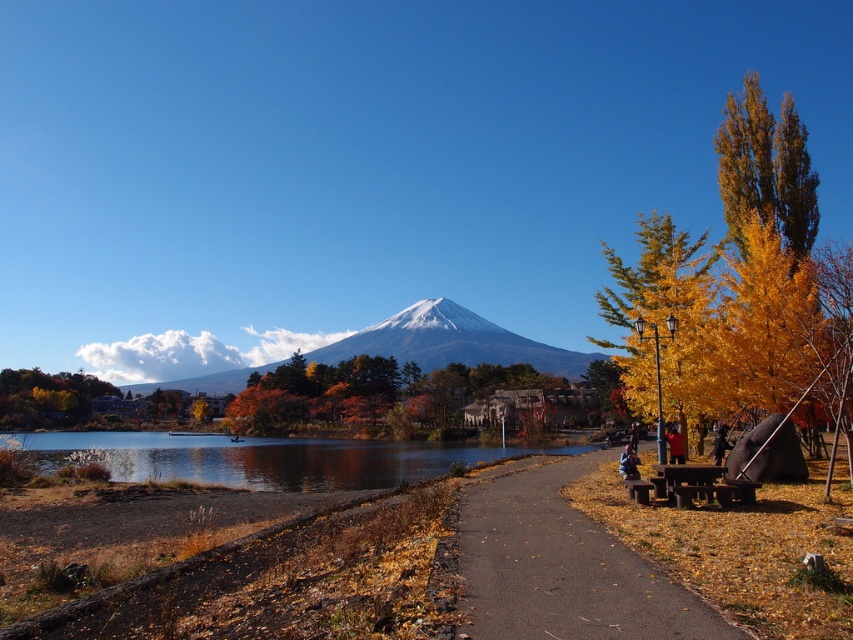
Looking at this image, which is more to the left, clear water at lower left or yellow fabric jacket at right?

From the viewer's perspective, clear water at lower left appears more on the left side.

Identify the location of clear water at lower left. The width and height of the screenshot is (853, 640). (262, 458).

Locate an element on the screen. The image size is (853, 640). clear water at lower left is located at coordinates (262, 458).

Is clear water at lower left positioned before white snow-covered mountain at center?

Yes, clear water at lower left is closer to the viewer.

Is point (250, 468) positioned before point (466, 362)?

That is True.

This screenshot has height=640, width=853. Describe the element at coordinates (262, 458) in the screenshot. I see `clear water at lower left` at that location.

I want to click on clear water at lower left, so click(262, 458).

Who is taller, brown asphalt path at center or yellow fabric jacket at right?

brown asphalt path at center

Is brown asphalt path at center bigger than yellow fabric jacket at right?

Indeed, brown asphalt path at center has a larger size compared to yellow fabric jacket at right.

Measure the distance between brown asphalt path at center and camera.

brown asphalt path at center is 19.81 feet from camera.

This screenshot has width=853, height=640. In order to click on brown asphalt path at center in this screenshot , I will do `click(561, 566)`.